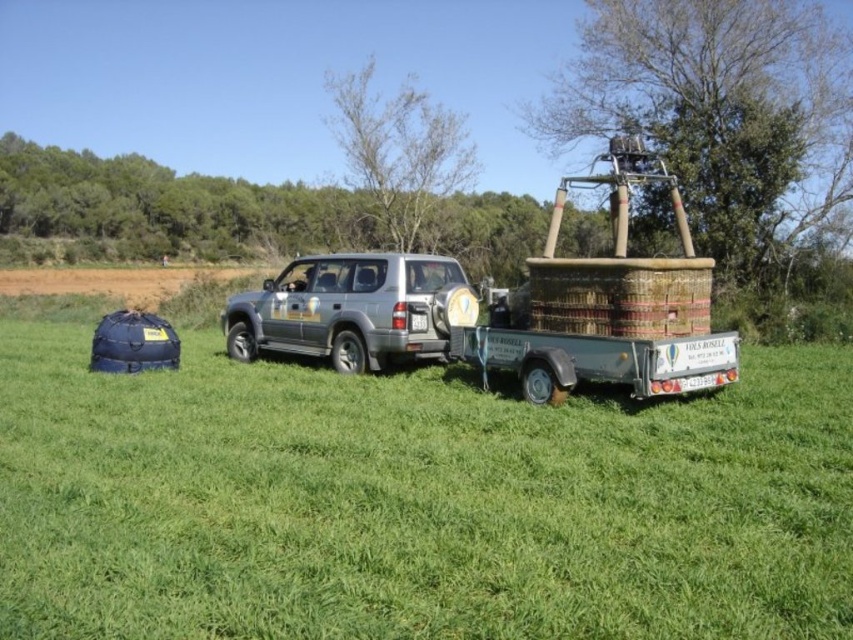
Does green grassy field at center appear on the left side of silver metallic suv at center?

Incorrect, green grassy field at center is not on the left side of silver metallic suv at center.

Does point (94, 480) lie behind point (408, 304)?

No, it is not.

Locate an element on the screen. The height and width of the screenshot is (640, 853). green grassy field at center is located at coordinates (415, 500).